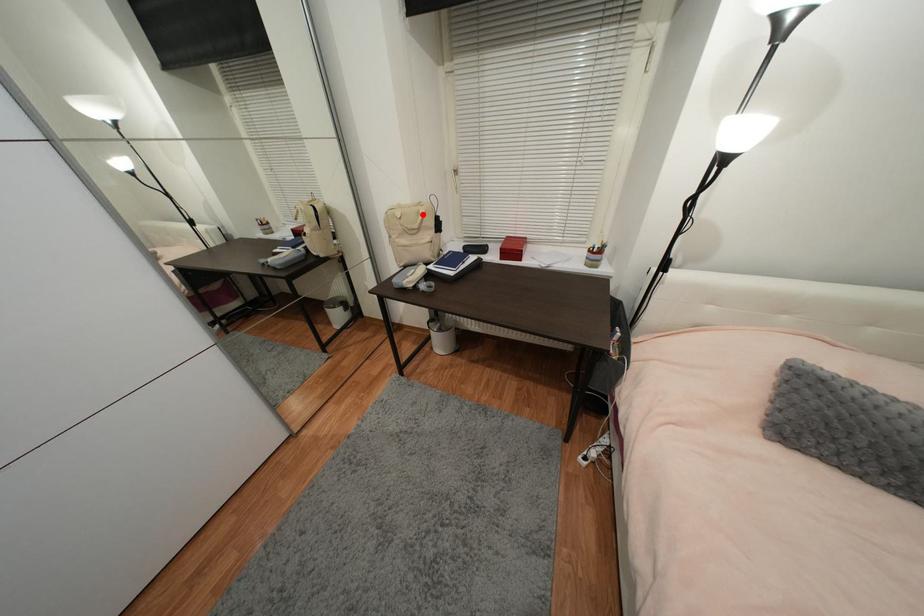
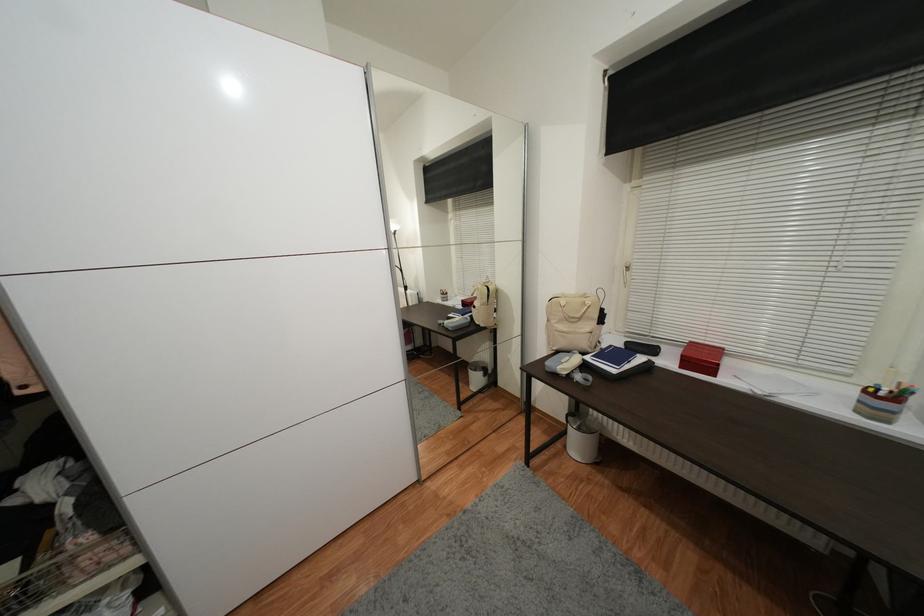
The point at the highlighted location is marked in the first image. Where is the corresponding point in the second image?

(589, 305)